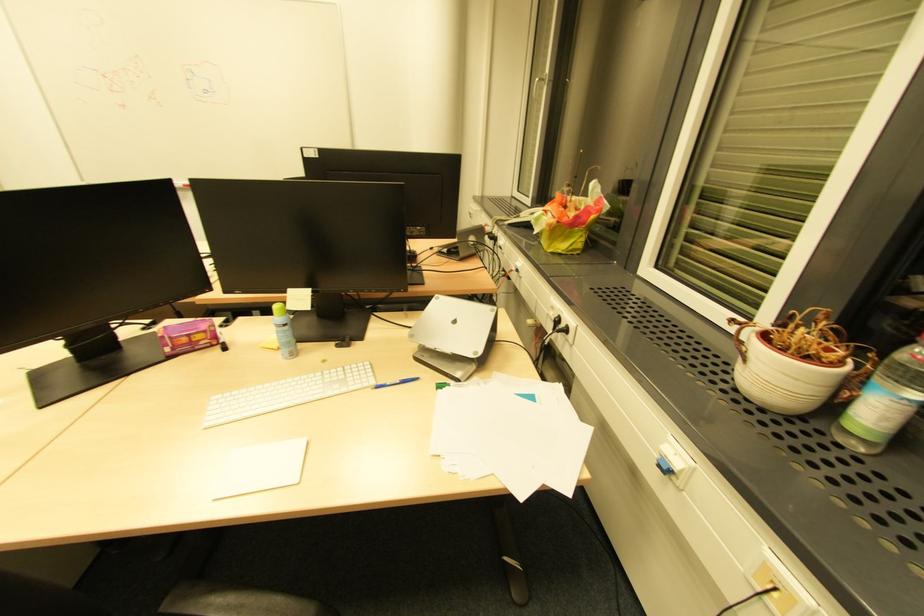
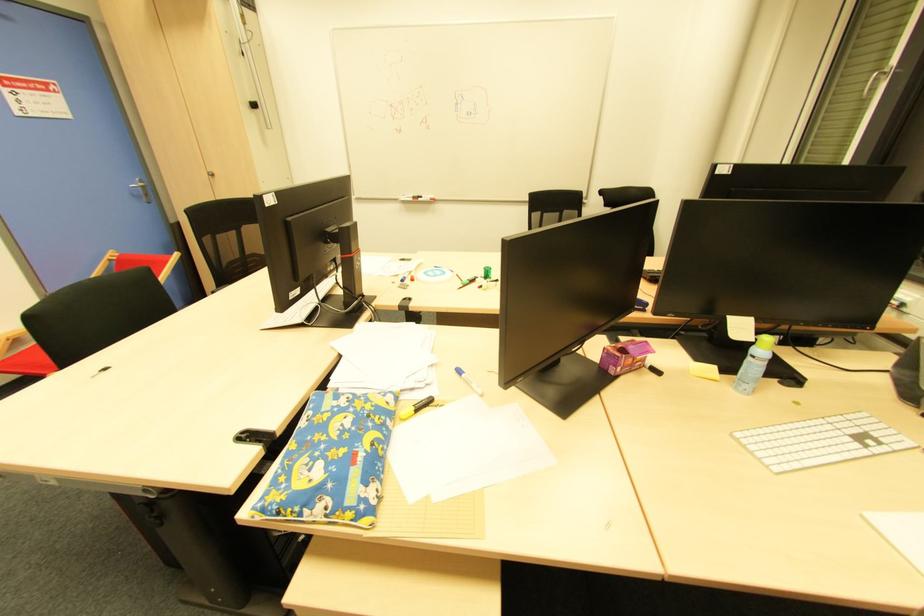
Question: In a continuous first-person perspective shot, in which direction is the camera moving?

Choices:
 (A) Left
 (B) Right
 (C) Forward
 (D) Backward

Answer: (A)